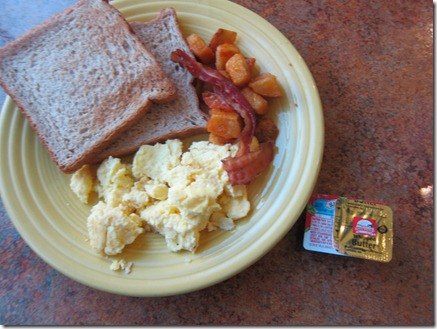
This screenshot has height=329, width=437. What are the coordinates of `table top` in the screenshot? It's located at (304, 299).